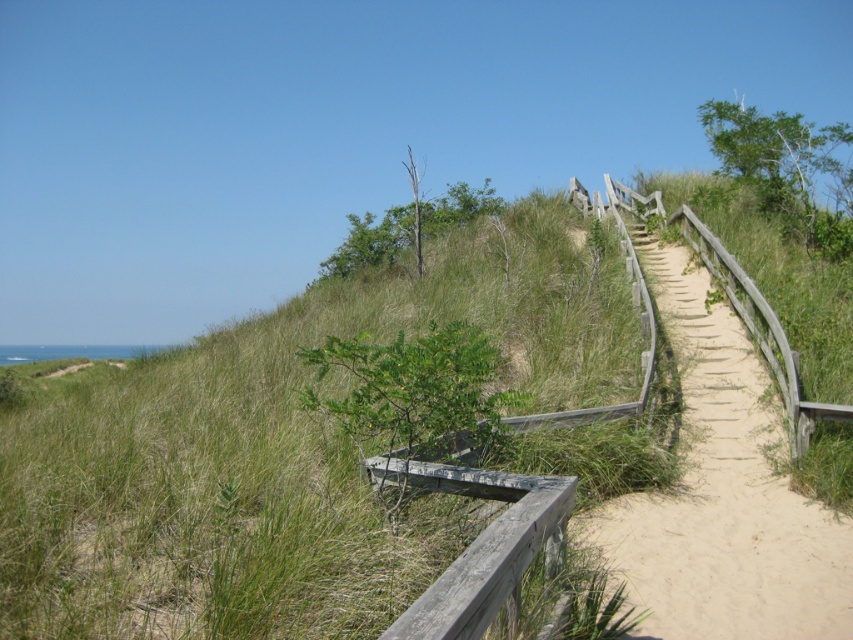
Question: Can you confirm if green grassy at upper center is positioned above wooden boardwalk at upper right?

Choices:
 (A) no
 (B) yes

Answer: (B)

Question: Which object appears farthest from the camera in this image?

Choices:
 (A) wooden boardwalk at upper right
 (B) green grassy at upper center

Answer: (A)

Question: Does green grassy at upper center appear on the left side of wooden boardwalk at upper right?

Choices:
 (A) no
 (B) yes

Answer: (B)

Question: Can you confirm if green grassy at upper center is positioned to the right of wooden boardwalk at upper right?

Choices:
 (A) yes
 (B) no

Answer: (B)